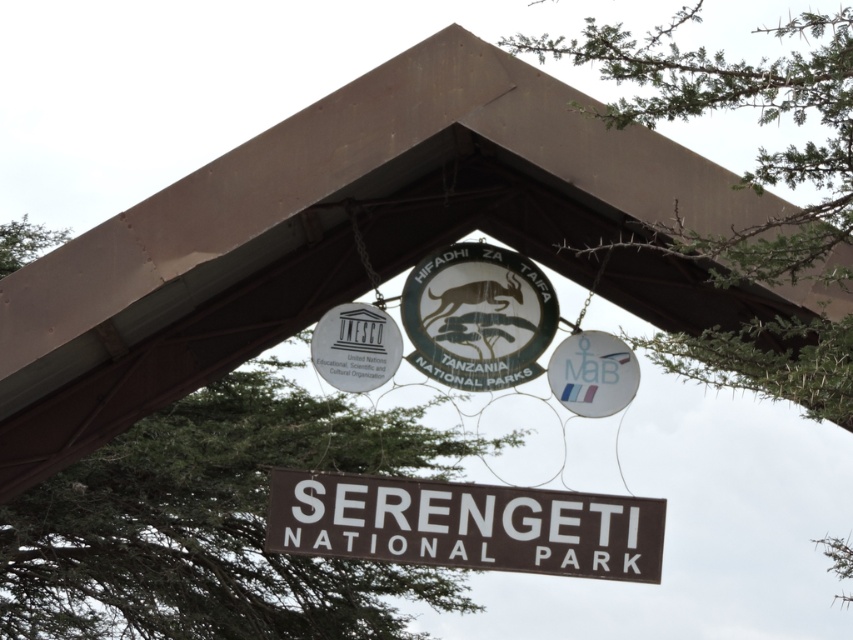
You are a visitor approaching the entrance of Serengeti National Park and see a green leafy tree at center and a brown matte signboard at center. Which object is larger in size?

The green leafy tree at center is bigger than the brown matte signboard at center.

In the scene shown: You are standing in front of the UNESCO sign at Serengeti National Park. There are two points marked on the sign. The first point is at coordinate (0, 536) and the second is at (430, 369). Which point is closer to you?

The point at coordinate (0, 536) is closer to you because it is further to the viewer than the point at (430, 369).